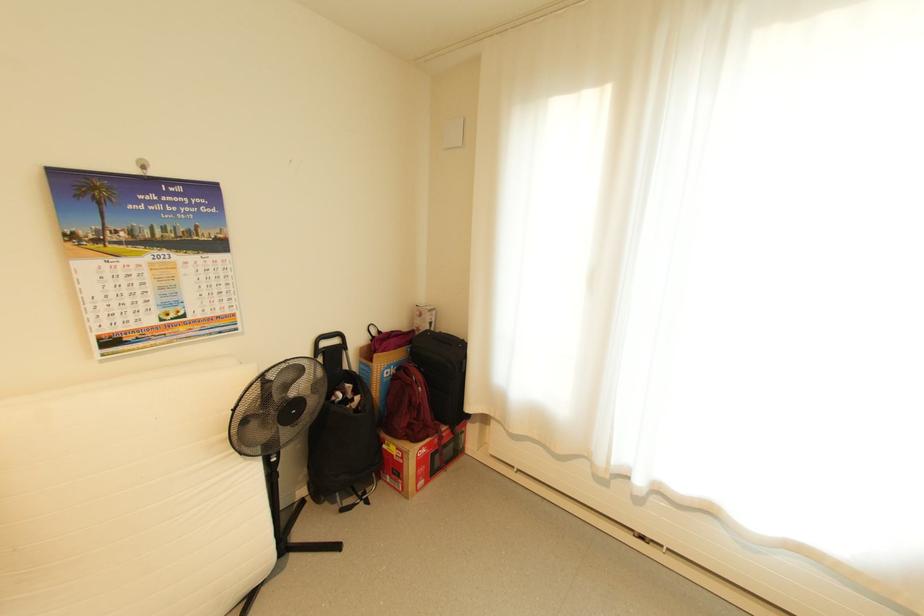
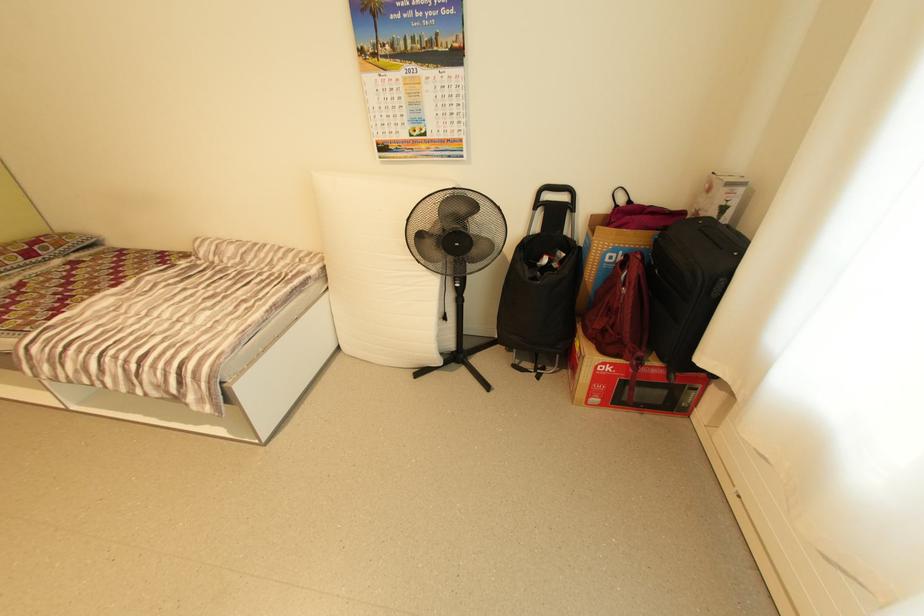
Locate, in the second image, the point that corresponds to (x=281, y=460) in the first image.

(464, 286)